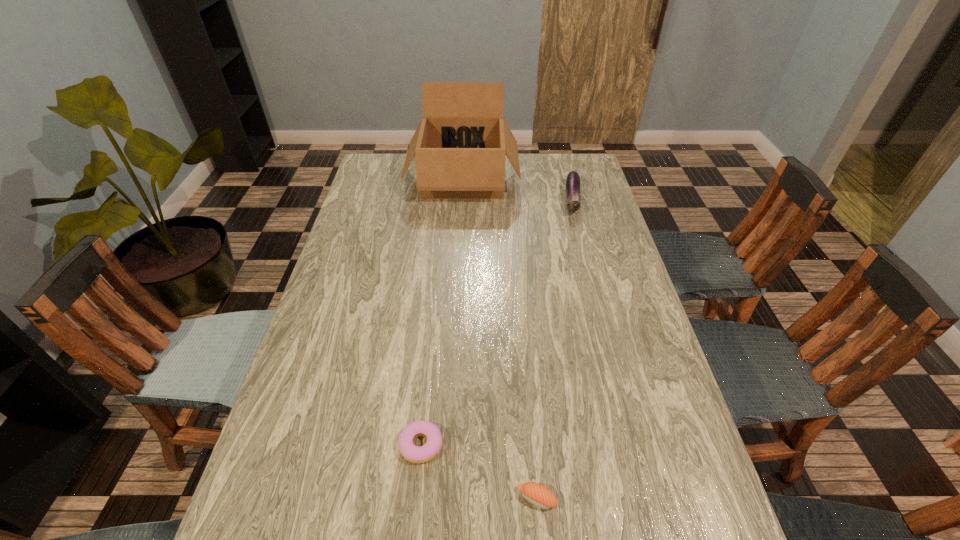
Locate an element on the screen. free space between the doughnut and the box is located at coordinates (442, 312).

Where is `free point between the rightmost object and the nearest object`? The width and height of the screenshot is (960, 540). free point between the rightmost object and the nearest object is located at coordinates (555, 349).

In order to click on blank region between the doughnut and the rightmost object in this screenshot , I will do `click(496, 322)`.

Where is `free point between the doughnut and the third shortest object`? This screenshot has height=540, width=960. free point between the doughnut and the third shortest object is located at coordinates (496, 322).

Locate an element on the screen. free point between the second shortest object and the tallest object is located at coordinates (500, 339).

Where is `unoccupied position between the shortest object and the rightmost object`? The height and width of the screenshot is (540, 960). unoccupied position between the shortest object and the rightmost object is located at coordinates [x=496, y=322].

Locate an element on the screen. free space between the rightmost object and the third tallest object is located at coordinates (555, 349).

I want to click on vacant space in between the rightmost object and the second nearest object, so click(496, 322).

I want to click on free space between the sushi and the rightmost object, so click(x=555, y=349).

You are a GUI agent. You are given a task and a screenshot of the screen. Output one action in this format:
    pyautogui.click(x=<x>, y=<y>)
    Task: Click on the object that is the second closest to the box
    This screenshot has width=960, height=540.
    Given the screenshot: What is the action you would take?
    pyautogui.click(x=412, y=453)